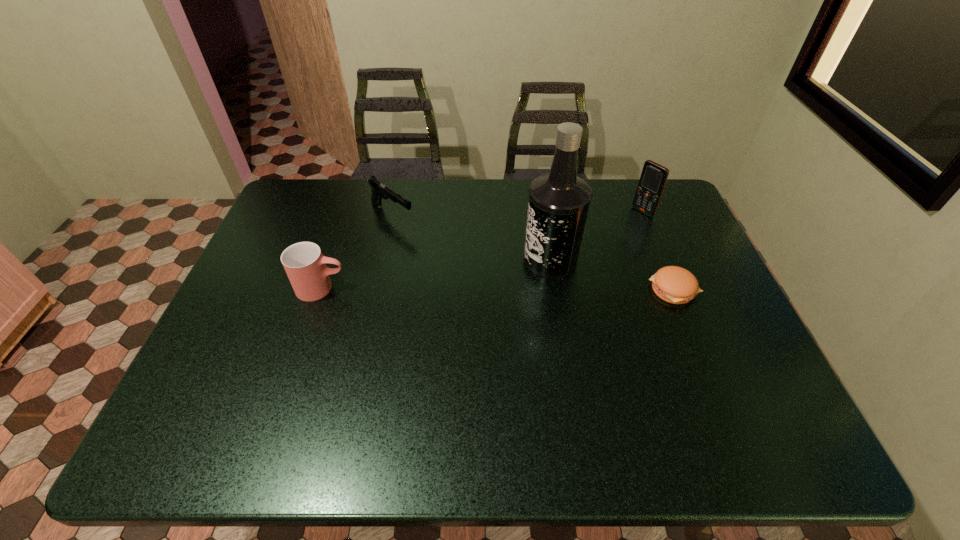
Find the location of `free spot on the desktop that is between the cup and the shortest object and is positioned on the screen of the fourth shortest object`. free spot on the desktop that is between the cup and the shortest object and is positioned on the screen of the fourth shortest object is located at coordinates (527, 289).

The image size is (960, 540). Find the location of `vacant spot on the desktop that is between the cup and the patty and is positioned at the aiming end of the gun`. vacant spot on the desktop that is between the cup and the patty and is positioned at the aiming end of the gun is located at coordinates (492, 289).

This screenshot has height=540, width=960. I want to click on free space on the desktop that is between the cup and the shortest object and is positioned on the front label of the third object from right to left, so click(487, 289).